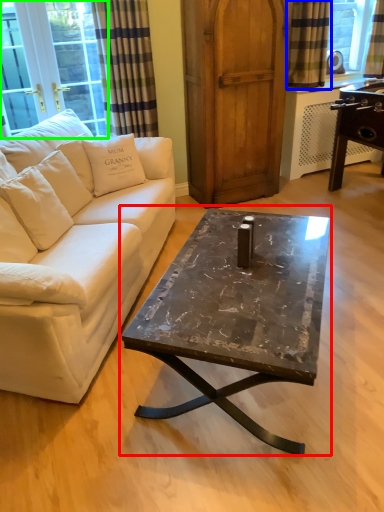
Question: Which is farther away from coffee table (highlighted by a red box)? curtain (highlighted by a blue box) or window screen (highlighted by a green box)?

Choices:
 (A) curtain
 (B) window screen

Answer: (A)